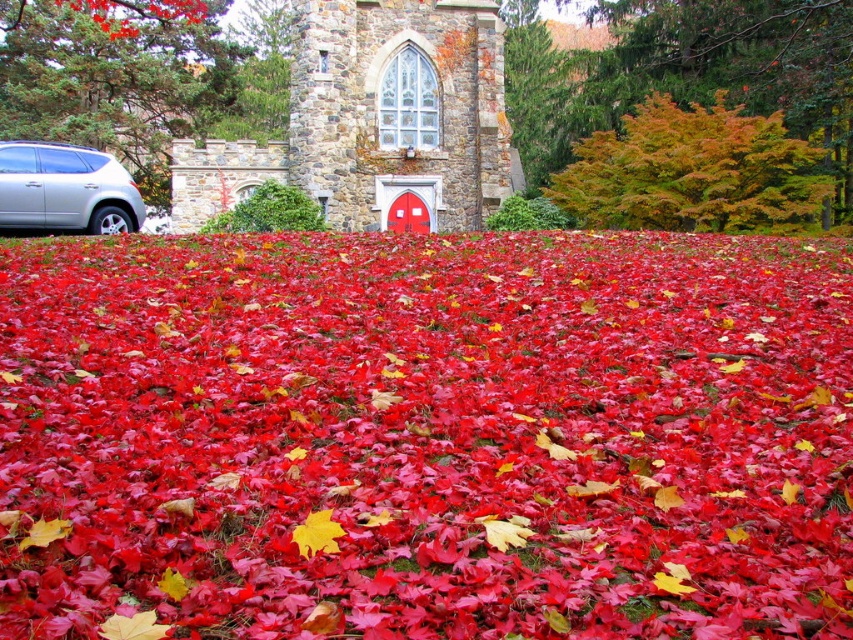
Who is positioned more to the left, stone church at center or yellow matte maple leaf at center?

stone church at center

Does stone church at center have a larger size compared to yellow matte maple leaf at center?

Yes.

Is point (318, 150) farther from viewer compared to point (300, 548)?

That is True.

Identify the location of stone church at center. The image size is (853, 640). (375, 120).

Identify the location of orange-golden foliage at center. This screenshot has width=853, height=640. (685, 74).

Is orange-golden foliage at center wider than green leafy tree at left?

Yes, orange-golden foliage at center is wider than green leafy tree at left.

This screenshot has height=640, width=853. What are the coordinates of `orange-golden foliage at center` in the screenshot? It's located at (685, 74).

Is stone church at center thinner than orange-golden foliage at center?

In fact, stone church at center might be wider than orange-golden foliage at center.

Does point (239, 173) lie behind point (558, 161)?

No, it is in front of (558, 161).

This screenshot has width=853, height=640. Identify the location of stone church at center. (375, 120).